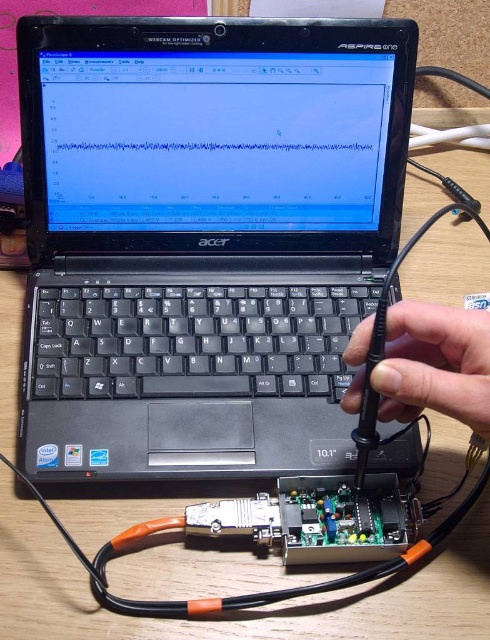
Is black plastic laptop at center in front of black plastic hand at center?

No, it is not.

Is black plastic laptop at center wider than black plastic hand at center?

Yes.

Who is more forward, (90, 460) or (430, 392)?

Point (430, 392) is in front.

Locate an element on the screen. Image resolution: width=490 pixels, height=640 pixels. black plastic laptop at center is located at coordinates (202, 237).